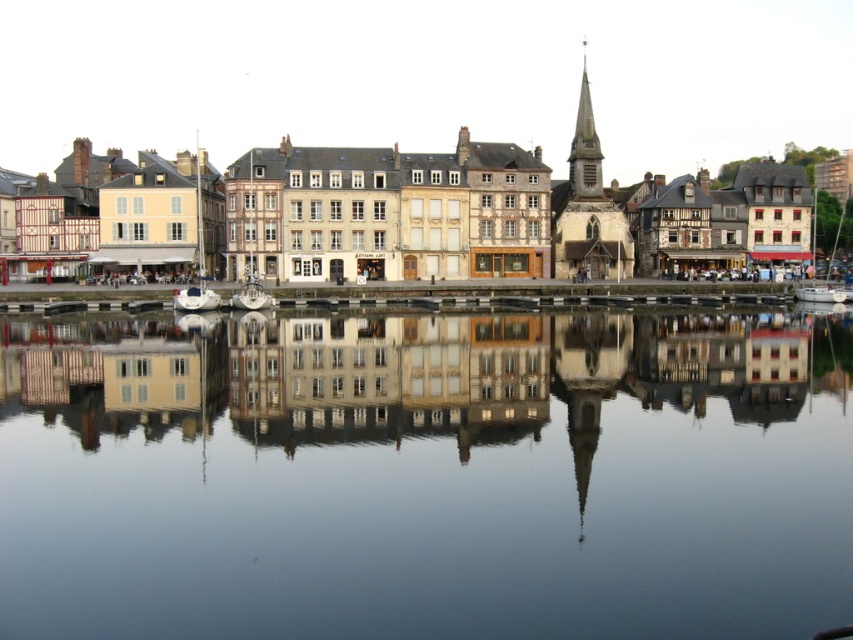
Who is more forward, (x=16, y=40) or (x=258, y=291)?

Positioned in front is point (x=258, y=291).

Which is behind, point (65, 124) or point (241, 296)?

Positioned behind is point (65, 124).

This screenshot has height=640, width=853. I want to click on wooden timber buildings at center, so click(x=285, y=93).

Is point (809, 451) positioned in front of point (645, 291)?

That is True.

At what (x,y) coordinates should I click in order to perform the action: click on smooth reflective water at center. Please return your answer as a coordinate pair (x, y). This screenshot has width=853, height=640. Looking at the image, I should click on (427, 476).

Can you confirm if white matte boat at center is positioned above white glossy boat at center?

No.

Is point (212, 292) closer to viewer compared to point (236, 307)?

Yes.

Who is more forward, (x=178, y=308) or (x=257, y=289)?

Point (x=257, y=289) is in front.

Where is `white matte boat at center`? This screenshot has width=853, height=640. white matte boat at center is located at coordinates click(x=195, y=298).